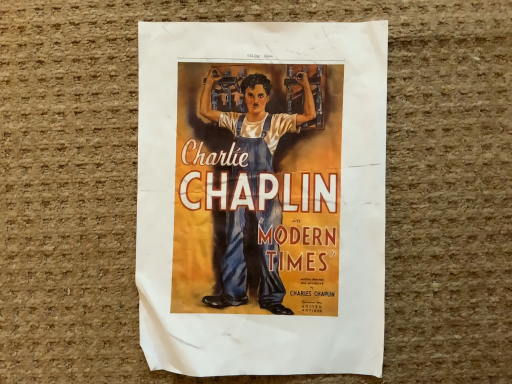
Describe the element at coordinates (262, 197) in the screenshot. The width and height of the screenshot is (512, 384). I see `matte paper poster at center` at that location.

What is the approximate height of matte paper poster at center?

0.67 inches.

In order to click on matte paper poster at center in this screenshot , I will do `click(262, 197)`.

This screenshot has width=512, height=384. I want to click on matte paper poster at center, so (262, 197).